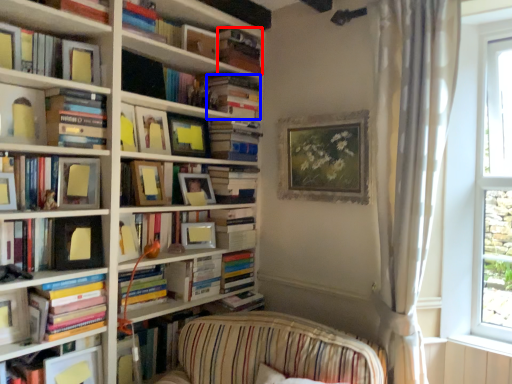
Question: Which of the following is the closest to the observer, book (highlighted by a red box) or book (highlighted by a blue box)?

Choices:
 (A) book
 (B) book

Answer: (A)